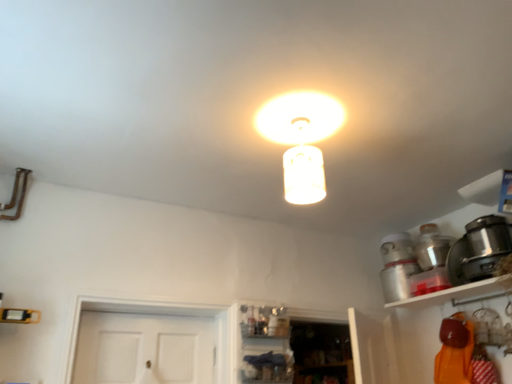
Question: Relative to white glossy shelf at upper right, is metallic silver pot at upper right, the second appliance in the front-to-back sequence, in front or behind?

Choices:
 (A) behind
 (B) front

Answer: (A)

Question: Is point (433, 264) positioned closer to the camera than point (413, 296)?

Choices:
 (A) farther
 (B) closer

Answer: (B)

Question: Which is farther from the matte glass lampshade at center?

Choices:
 (A) satin black pot at right, which is counted as the 1th appliance, starting from the front
 (B) metallic silver pot at upper right, the second appliance in the front-to-back sequence
 (C) white glossy shelf at upper right

Answer: (B)

Question: Which object is positioned closest to the satin black pot at right, which is counted as the 1th appliance, starting from the front?

Choices:
 (A) metallic silver pot at upper right, the second appliance in the front-to-back sequence
 (B) white glossy shelf at upper right
 (C) matte glass lampshade at center

Answer: (B)